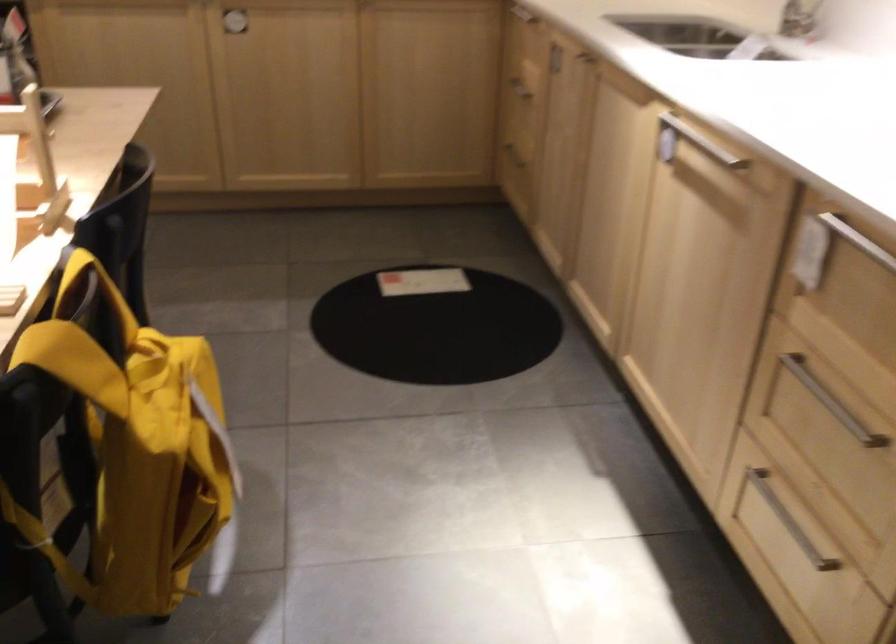
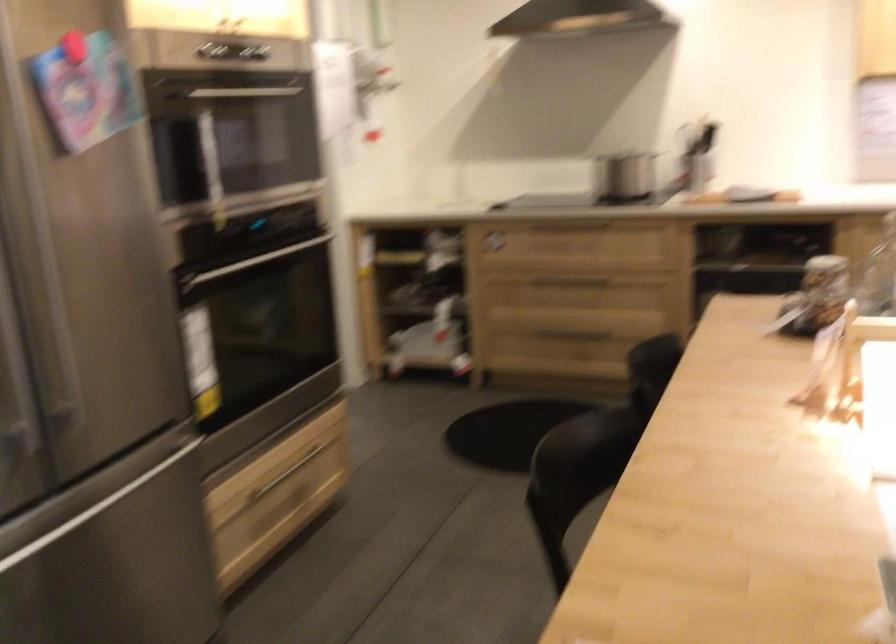
Question: The camera is either moving clockwise (left) or counter-clockwise (right) around the object. The first image is from the beginning of the video and the second image is from the end. Is the camera moving left or right when shooting the video?

Choices:
 (A) Left
 (B) Right

Answer: (B)